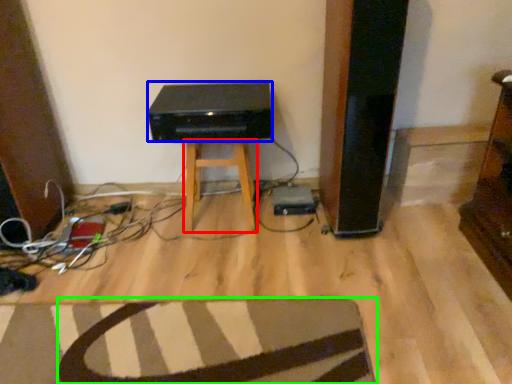
Question: Estimate the real-world distances between objects in this image. Which object is farther from stool (highlighted by a red box), stereo (highlighted by a blue box) or furniture (highlighted by a green box)?

Choices:
 (A) stereo
 (B) furniture

Answer: (B)